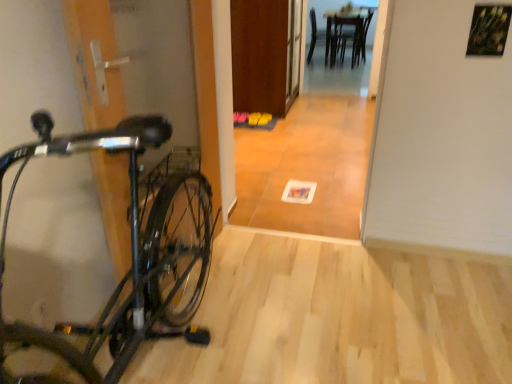
You are a GUI agent. You are given a task and a screenshot of the screen. Output one action in this format:
    pyautogui.click(x=<x>, y=<y>)
    Task: Click on the wooden chair at center
    
    Given the screenshot: What is the action you would take?
    pyautogui.click(x=318, y=36)

In order to face wooden chair at center, should I rotate leftwards or rightwards?

Turn right by 9.728 degrees to look at wooden chair at center.

This screenshot has width=512, height=384. Describe the element at coordinates (132, 254) in the screenshot. I see `shiny black bicycle at left` at that location.

This screenshot has height=384, width=512. Identify the location of wooden table at center. (347, 34).

This screenshot has height=384, width=512. I want to click on wooden door at center, so click(x=259, y=54).

Is wooden floor at center directly adjacent to wooden door at center?

No, wooden floor at center is not touching wooden door at center.

Do you think wooden floor at center is within wooden door at center, or outside of it?

wooden floor at center is spatially situated outside wooden door at center.

Does wooden floor at center have a smaller size compared to wooden door at center?

Indeed, wooden floor at center has a smaller size compared to wooden door at center.

Based on the photo, looking at the image, does wooden door at center seem bigger or smaller compared to wooden floor at center?

wooden door at center is bigger than wooden floor at center.

From the picture: Relative to wooden floor at center, is wooden door at center in front or behind?

Clearly, wooden door at center is behind wooden floor at center.

Is wooden floor at center completely or partially inside wooden door at center?

No.

Is wooden door at center turned away from wooden floor at center?

wooden door at center does not have its back to wooden floor at center.

Which is closer, [267,58] or [148,197]?

The point [148,197] is closer to the camera.

Is wooden door at center oriented towards shiny black bicycle at left?

No, wooden door at center does not turn towards shiny black bicycle at left.

Are wooden door at center and shiny black bicycle at left far apart?

Yes, wooden door at center and shiny black bicycle at left are located far from each other.

Is wooden table at center positioned in front of wooden door at center?

No, the depth of wooden table at center is greater than that of wooden door at center.

I want to click on door lying in front of the wooden table at center, so click(259, 54).

Looking at this image, how far apart are wooden table at center and wooden door at center?

The distance of wooden table at center from wooden door at center is 2.97 meters.

From a real-world perspective, is wooden table at center on top of wooden door at center?

Incorrect, from a real-world perspective, wooden table at center is lower than wooden door at center.

Is wooden chair at center located within wooden door at center?

No, wooden chair at center is not surrounded by wooden door at center.

Which is behind, wooden door at center or wooden chair at center?

Positioned behind is wooden chair at center.

Considering the relative sizes of wooden door at center and wooden chair at center in the image provided, is wooden door at center wider than wooden chair at center?

Correct, the width of wooden door at center exceeds that of wooden chair at center.

Considering the relative sizes of wooden door at center and wooden chair at center in the image provided, is wooden door at center taller than wooden chair at center?

Yes.

Which is more to the left, wooden floor at center or wooden chair at center?

wooden floor at center.

Is wooden floor at center further to the viewer compared to wooden chair at center?

No, it is in front of wooden chair at center.

From a real-world perspective, which is physically above, wooden floor at center or wooden chair at center?

wooden floor at center, from a real-world perspective.

Who is taller, wooden floor at center or wooden chair at center?

With more height is wooden floor at center.

From a real-world perspective, who is located higher, wooden chair at center or wooden door at center?

In real-world perspective, wooden door at center is above.

Is wooden door at center inside wooden chair at center?

No, wooden door at center is located outside of wooden chair at center.

Which object is closer to the camera taking this photo, wooden chair at center or wooden door at center?

wooden door at center.

Who is taller, wooden chair at center or wooden door at center?

wooden door at center.

Where is `corridor lying on the right of wooden door at center`? corridor lying on the right of wooden door at center is located at coordinates (310, 156).

Where is `corridor below the wooden door at center (from the image's perspective)`? corridor below the wooden door at center (from the image's perspective) is located at coordinates (310, 156).

From the image, which object appears to be nearer to shiny black bicycle at left, wooden chair at center or wooden table at center?

wooden chair at center is closer to shiny black bicycle at left.

Looking at the image, which one is located further to wooden floor at center, wooden table at center or wooden chair at center?

wooden chair at center.

Estimate the real-world distances between objects in this image. Which object is closer to wooden floor at center, wooden door at center or shiny black bicycle at left?

wooden door at center.

Based on their spatial positions, is shiny black bicycle at left or wooden chair at center further from wooden floor at center?

Among the two, wooden chair at center is located further to wooden floor at center.

From the image, which object appears to be farther from wooden table at center, wooden chair at center or shiny black bicycle at left?

shiny black bicycle at left lies further to wooden table at center than the other object.

Which object lies further to the anchor point wooden chair at center, shiny black bicycle at left or wooden table at center?

Based on the image, shiny black bicycle at left appears to be further to wooden chair at center.

Considering their positions, is wooden chair at center positioned closer to shiny black bicycle at left than wooden door at center?

wooden door at center is positioned closer to the anchor shiny black bicycle at left.

When comparing their distances from shiny black bicycle at left, does wooden table at center or wooden chair at center seem closer?

wooden chair at center lies closer to shiny black bicycle at left than the other object.

I want to click on door between shiny black bicycle at left and wooden table at center in the front-back direction, so click(259, 54).

Find the location of a particular element. The height and width of the screenshot is (384, 512). corridor between shiny black bicycle at left and wooden door at center along the z-axis is located at coordinates (310, 156).

You are a GUI agent. You are given a task and a screenshot of the screen. Output one action in this format:
    pyautogui.click(x=<x>, y=<y>)
    Task: Click on the door positioned between wooden floor at center and wooden table at center from near to far
    
    Given the screenshot: What is the action you would take?
    pyautogui.click(x=259, y=54)

Find the location of a particular element. Image resolution: width=512 pixels, height=384 pixels. corridor between shiny black bicycle at left and wooden chair at center from front to back is located at coordinates (310, 156).